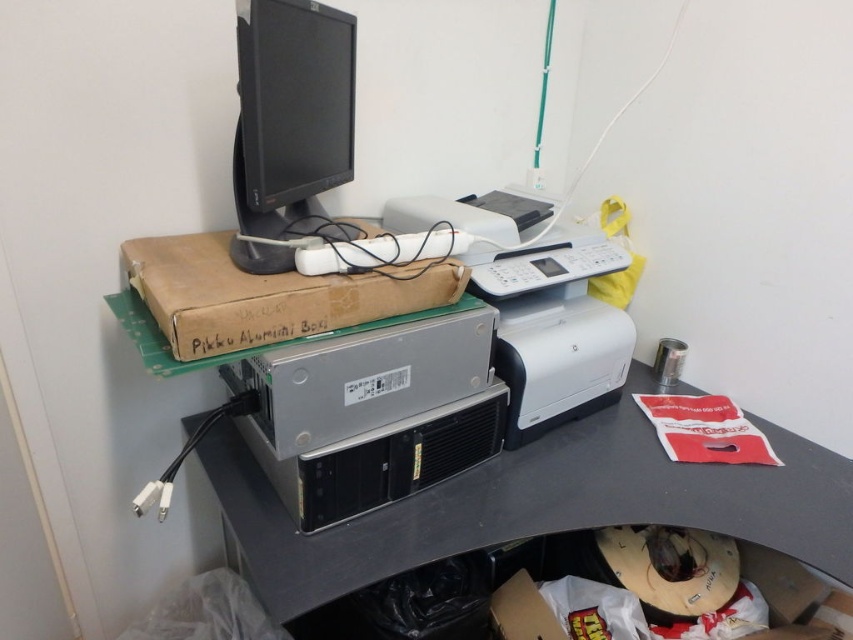
Question: Which point appears closest to the camera in this image?

Choices:
 (A) (250, 93)
 (B) (503, 214)

Answer: (A)

Question: From the image, what is the correct spatial relationship of white plastic printer at center in relation to black glossy monitor at upper center?

Choices:
 (A) left
 (B) right

Answer: (B)

Question: Is white plastic printer at center behind black glossy monitor at upper center?

Choices:
 (A) yes
 (B) no

Answer: (A)

Question: Is white plastic printer at center below brown cardboard box at center?

Choices:
 (A) yes
 (B) no

Answer: (A)

Question: Among these points, which one is farthest from the camera?

Choices:
 (A) (227, 280)
 (B) (306, 58)

Answer: (B)

Question: Which object appears farthest from the camera in this image?

Choices:
 (A) silver metallic computer desk at center
 (B) brown cardboard box at center

Answer: (A)